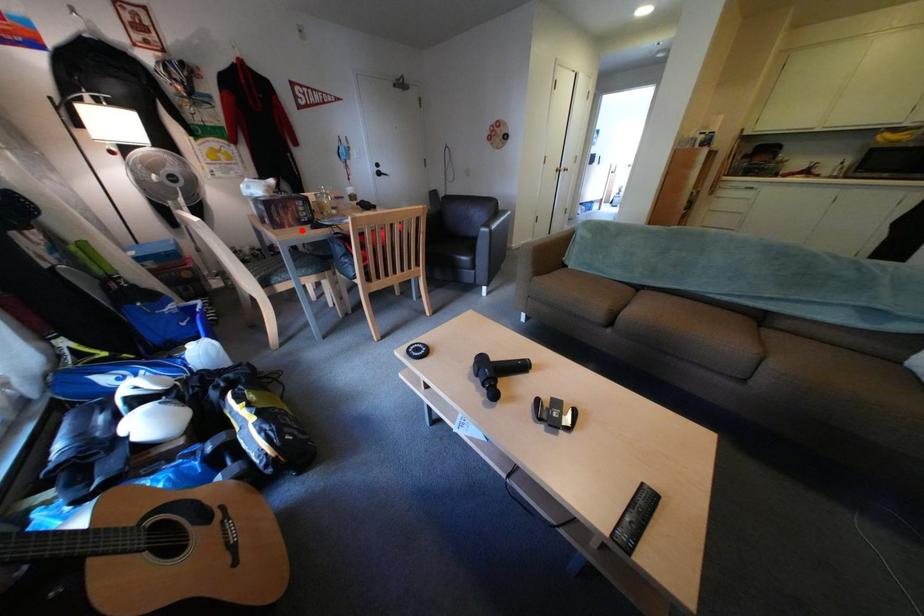
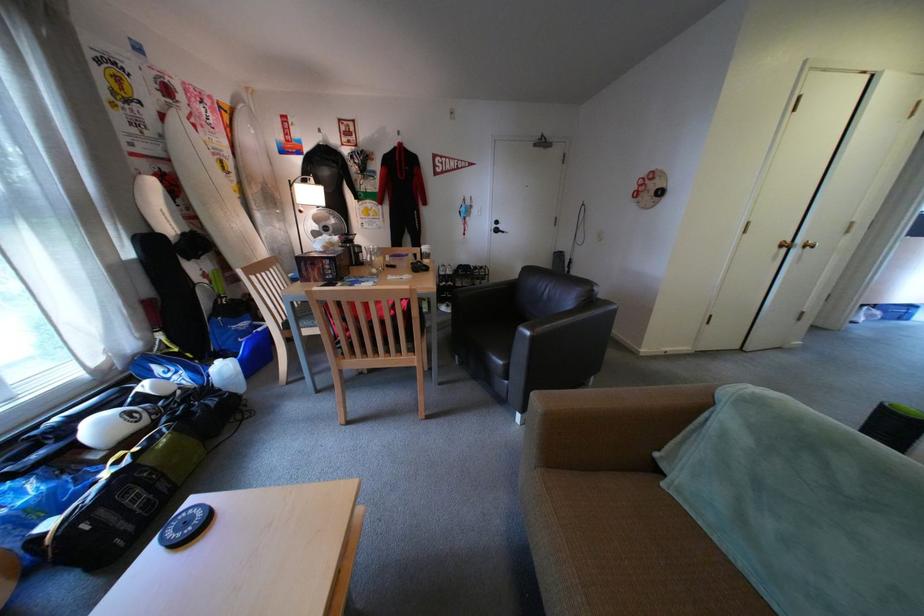
Question: I am providing you with two images of the same scene from different viewpoints. A red point is shown in image1. For the corresponding object point in image2, is it positioned nearer or farther from the camera?

Choices:
 (A) Nearer
 (B) Farther

Answer: (B)